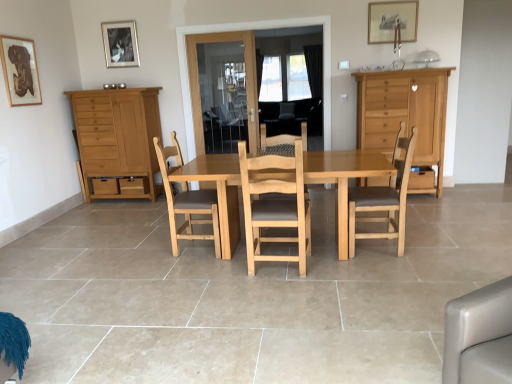
Question: Could you tell me if wooden framed map at upper left, arranged as the first picture frame when viewed from the front, is turned towards light brown wood cabinet at right, which appears as the 2th cabinetry when viewed from the left?

Choices:
 (A) yes
 (B) no

Answer: (A)

Question: Is wooden framed map at upper left, arranged as the first picture frame when viewed from the front, touching light brown wood cabinet at right, which appears as the 2th cabinetry when viewed from the left?

Choices:
 (A) no
 (B) yes

Answer: (A)

Question: Is wooden framed map at upper left, the 1th picture frame when ordered from left to right, positioned in front of light brown wood cabinet at right, which appears as the 2th cabinetry when viewed from the left?

Choices:
 (A) yes
 (B) no

Answer: (A)

Question: Is wooden framed map at upper left, positioned as the 3th picture frame in back-to-front order, thinner than light brown wood cabinet at right, which is the 1th cabinetry in right-to-left order?

Choices:
 (A) yes
 (B) no

Answer: (A)

Question: Would you say wooden framed map at upper left, the 1th picture frame when ordered from left to right, is outside light brown wood cabinet at right, which is the 1th cabinetry in right-to-left order?

Choices:
 (A) no
 (B) yes

Answer: (B)

Question: Can you confirm if wooden framed map at upper left, the 1th picture frame when ordered from left to right, is bigger than light brown wood cabinet at right, which is the 1th cabinetry in right-to-left order?

Choices:
 (A) yes
 (B) no

Answer: (B)

Question: Is wooden picture frame at upper center, which appears as the second picture frame when viewed from the front, smaller than light brown wooden table at center?

Choices:
 (A) yes
 (B) no

Answer: (A)

Question: Considering the relative sizes of wooden picture frame at upper center, which appears as the second picture frame when viewed from the front, and light brown wooden table at center in the image provided, is wooden picture frame at upper center, which appears as the second picture frame when viewed from the front, shorter than light brown wooden table at center?

Choices:
 (A) no
 (B) yes

Answer: (B)

Question: Is wooden picture frame at upper center, which is the 3th picture frame in left-to-right order, next to light brown wooden table at center and touching it?

Choices:
 (A) no
 (B) yes

Answer: (A)

Question: Considering the relative sizes of wooden picture frame at upper center, which is the 3th picture frame in left-to-right order, and light brown wooden table at center in the image provided, is wooden picture frame at upper center, which is the 3th picture frame in left-to-right order, thinner than light brown wooden table at center?

Choices:
 (A) yes
 (B) no

Answer: (A)

Question: From the image's perspective, does wooden picture frame at upper center, positioned as the second picture frame in back-to-front order, appear lower than light brown wooden table at center?

Choices:
 (A) yes
 (B) no

Answer: (B)

Question: From a real-world perspective, is wooden picture frame at upper center, which ranks as the first picture frame in right-to-left order, physically below light brown wooden table at center?

Choices:
 (A) yes
 (B) no

Answer: (B)

Question: Is wooden picture frame at upper center, which is the 3th picture frame in left-to-right order, located outside wooden drawer at right?

Choices:
 (A) yes
 (B) no

Answer: (A)